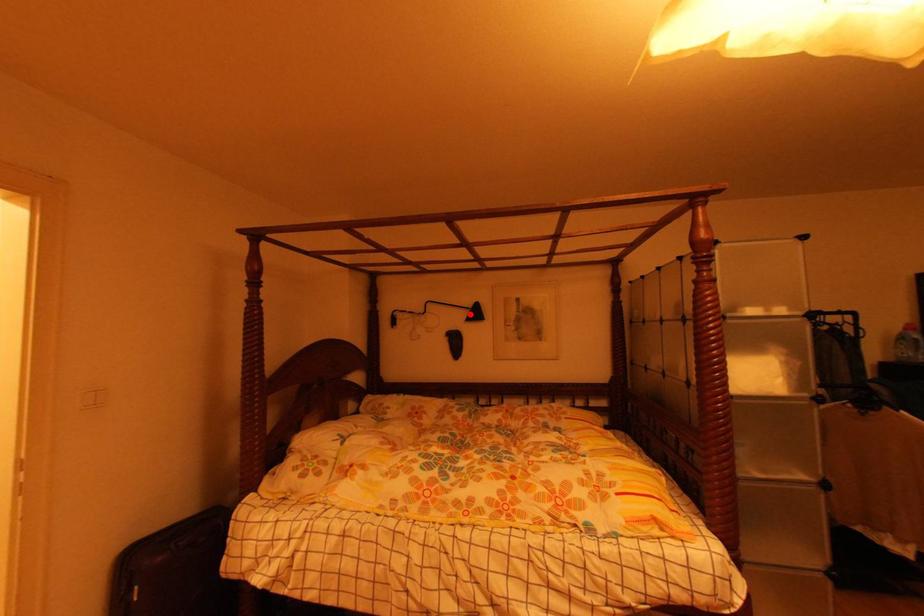
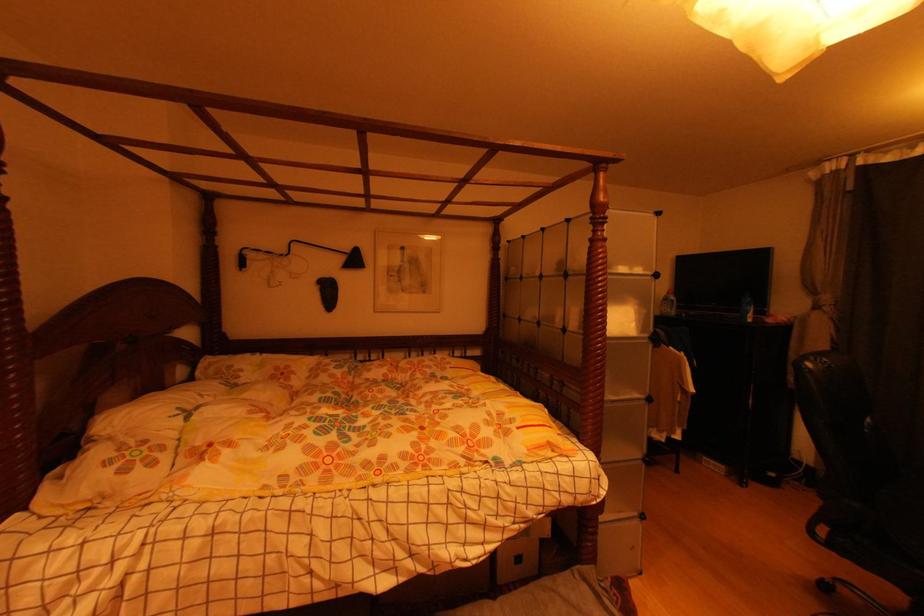
Question: I am providing you with two images of the same scene from different viewpoints. A red point is marked on the first image. Is the red point's position out of view in image 2?

Choices:
 (A) Yes
 (B) No

Answer: (B)